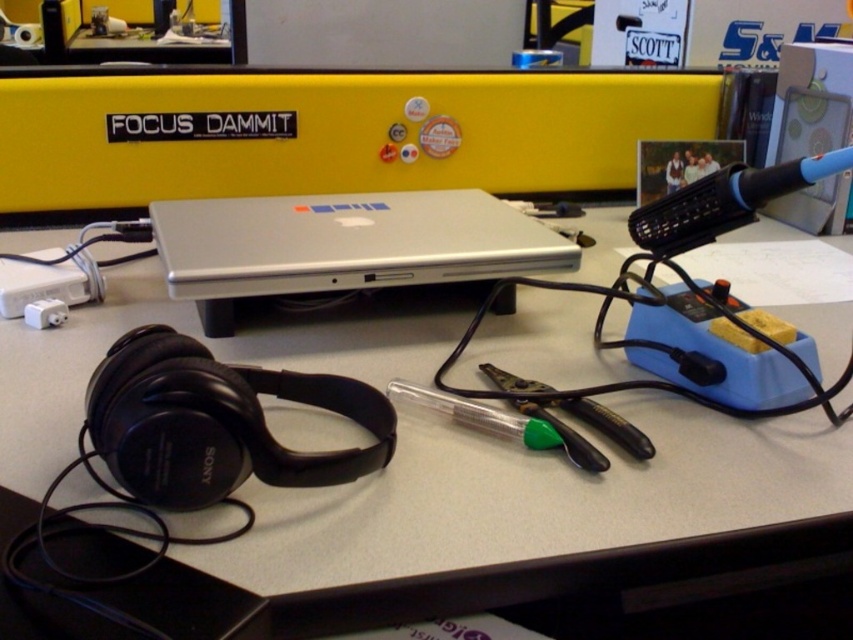
Question: Can you confirm if white plastic computer desk at center is bigger than silver metallic laptop at center?

Choices:
 (A) no
 (B) yes

Answer: (B)

Question: Is white plastic computer desk at center smaller than silver metallic laptop at center?

Choices:
 (A) no
 (B) yes

Answer: (A)

Question: Is white plastic computer desk at center above silver metallic laptop at center?

Choices:
 (A) no
 (B) yes

Answer: (A)